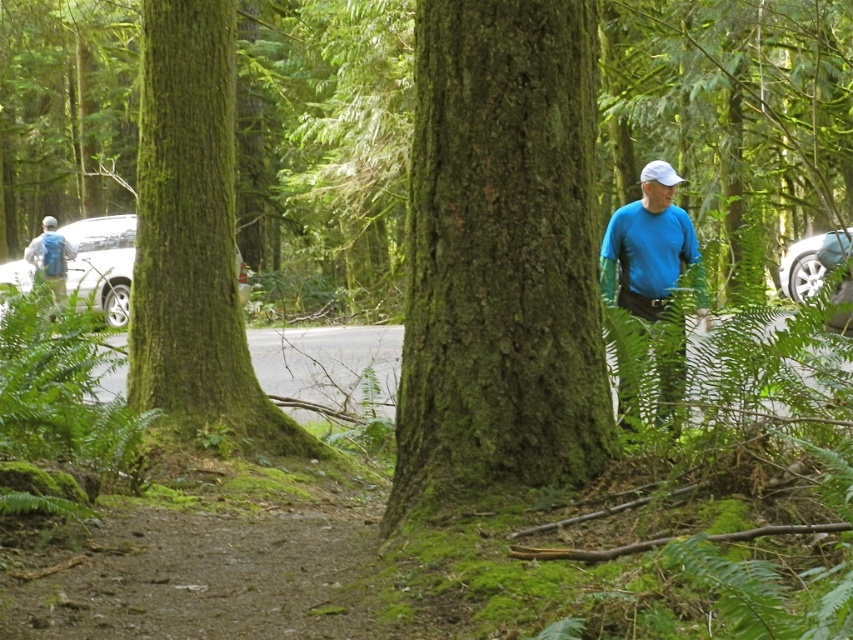
You are hiking on a forest path and see a metallic silver car at right and a matte gray backpack at left. Which object is positioned farther to the east?

The metallic silver car at right is positioned farther to the east because it is to the right of the matte gray backpack at left, assuming the hiker is facing north along the path.

You are hiking in the forest and see the green mossy tree at center and the white glossy car at left. Which object is nearer to you?

The green mossy tree at center is closer to the viewer than the white glossy car at left.

You are a hiker who wants to take a photo of the green mossy tree at center and the matte gray backpack at left. Since you have a wide angle lens, can you capture both objects in the same frame without moving your camera position?

The green mossy tree at center is below matte gray backpack at left, so yes, you can capture both in the same frame as long as your camera is positioned to include both the lower tree and the higher backpack in the frame.